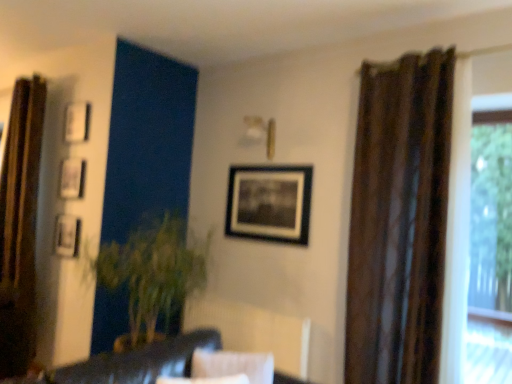
Question: Considering their positions, is black matte picture frame at center, arranged as the 1th picture frame when viewed from the right, located in front of or behind dark brown leather couch at lower center?

Choices:
 (A) behind
 (B) front

Answer: (A)

Question: In the image, is black matte picture frame at center, arranged as the 1th picture frame when viewed from the right, on the left side or the right side of dark brown leather couch at lower center?

Choices:
 (A) left
 (B) right

Answer: (B)

Question: Considering the real-world distances, which object is closest to the metallic silver picture frame at upper left, marked as the 1th picture frame in a left-to-right arrangement?

Choices:
 (A) black matte picture frame at center, arranged as the 1th picture frame when viewed from the right
 (B) brown textured curtain at left, the 2th curtain positioned from the front
 (C) brown textured curtain at right, the first curtain from the front
 (D) white matte picture frame at upper left, placed as the third picture frame when sorted from left to right
 (E) dark brown leather couch at lower center

Answer: (B)

Question: Based on their relative distances, which object is farther from the brown textured curtain at left, which appears as the first curtain when viewed from the back?

Choices:
 (A) dark brown leather couch at lower center
 (B) matte black picture frame at upper left, which appears as the second picture frame when viewed from the left
 (C) brown textured curtain at right, positioned as the second curtain in back-to-front order
 (D) black matte picture frame at center, arranged as the 1th picture frame when viewed from the right
 (E) white matte picture frame at upper left, placed as the third picture frame when sorted from left to right

Answer: (C)